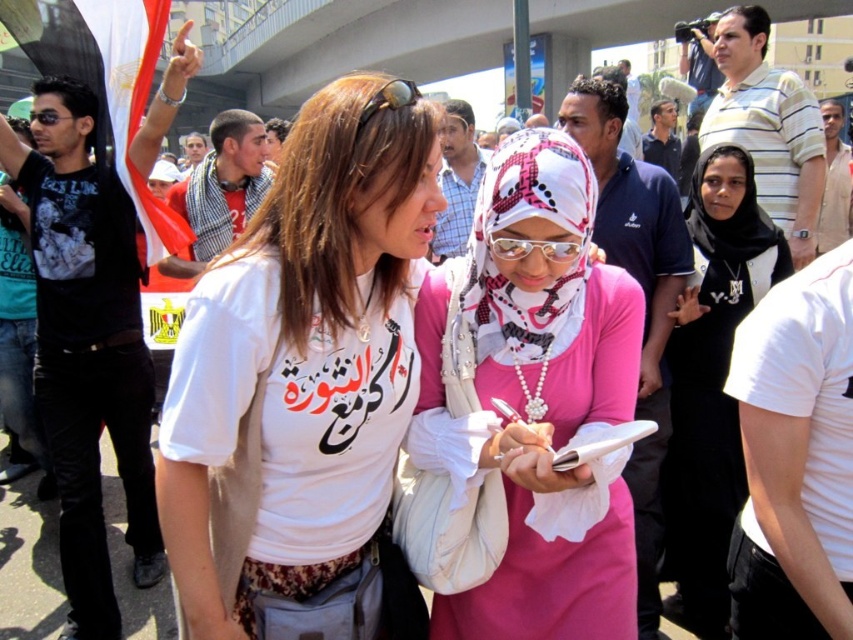
Question: Which point is closer to the camera taking this photo?

Choices:
 (A) (540, 548)
 (B) (711, 358)

Answer: (A)

Question: Which is farther from the transparent plastic goggles at center?

Choices:
 (A) gold metallic goggles at center
 (B) white matte t-shirt at center
 (C) pink printed scarf at center

Answer: (A)

Question: Is the position of pink printed scarf at center more distant than that of transparent plastic goggles at center?

Choices:
 (A) yes
 (B) no

Answer: (B)

Question: Can you confirm if pink satin hijab at center is thinner than pink printed scarf at center?

Choices:
 (A) yes
 (B) no

Answer: (B)

Question: Is white matte t-shirt at center further to the viewer compared to pink satin hijab at center?

Choices:
 (A) no
 (B) yes

Answer: (B)

Question: Which object is the closest to the white matte t-shirt at center?

Choices:
 (A) transparent plastic goggles at center
 (B) black jersey at center

Answer: (A)